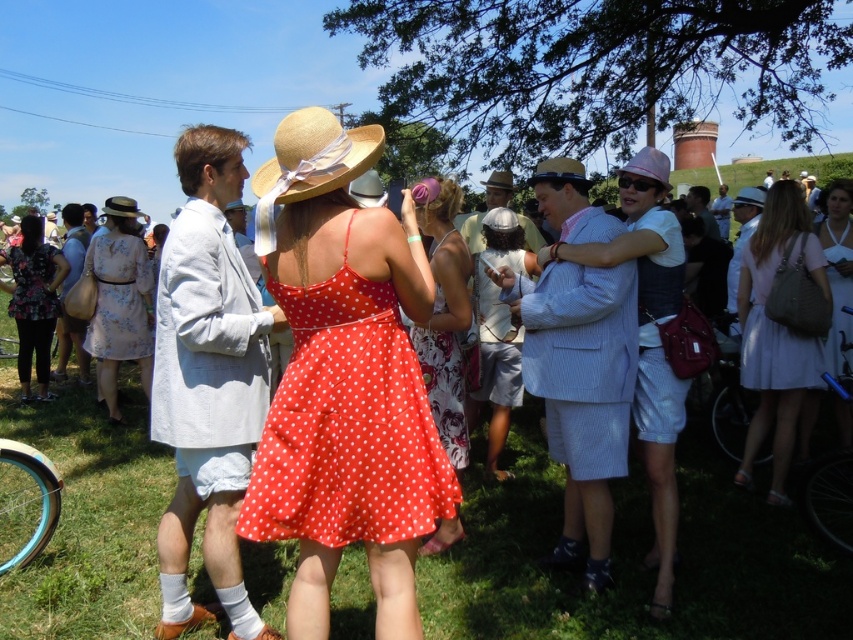
Question: Is polka dot fabric dress at center closer to camera compared to matte pink dress at right?

Choices:
 (A) no
 (B) yes

Answer: (B)

Question: Estimate the real-world distances between objects in this image. Which object is farther from the polka dot fabric dress at center?

Choices:
 (A) floral-patterned dress at left
 (B) white satin dress at lower right
 (C) matte pink dress at right
 (D) matte white shorts at center

Answer: (A)

Question: Does polka dot fabric dress at center appear over white satin dress at lower right?

Choices:
 (A) yes
 (B) no

Answer: (B)

Question: Does polka dot fabric dress at center lie behind straw hat at center?

Choices:
 (A) yes
 (B) no

Answer: (A)

Question: Among these points, which one is farthest from the camera?

Choices:
 (A) (764, 356)
 (B) (32, 400)
 (C) (302, 474)
 (D) (675, 388)

Answer: (B)

Question: Which of the following is the closest to the observer?

Choices:
 (A) matte pink dress at right
 (B) white woven bag at center

Answer: (B)